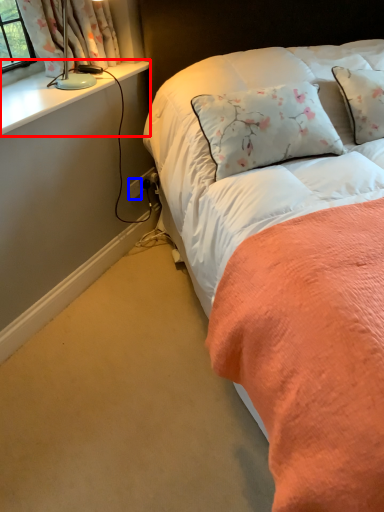
Question: Among these objects, which one is nearest to the camera, window sill (highlighted by a red box) or power outlet (highlighted by a blue box)?

Choices:
 (A) window sill
 (B) power outlet

Answer: (A)